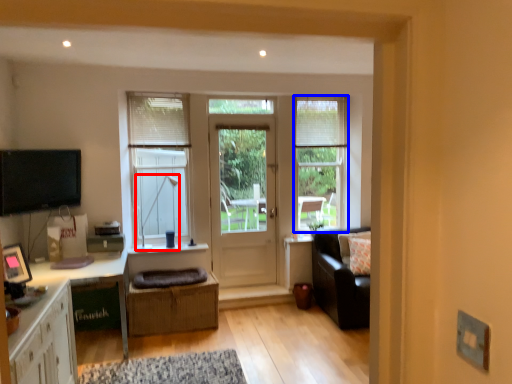
Question: Which point is further to the camera, lamp (highlighted by a red box) or window (highlighted by a blue box)?

Choices:
 (A) lamp
 (B) window

Answer: (B)